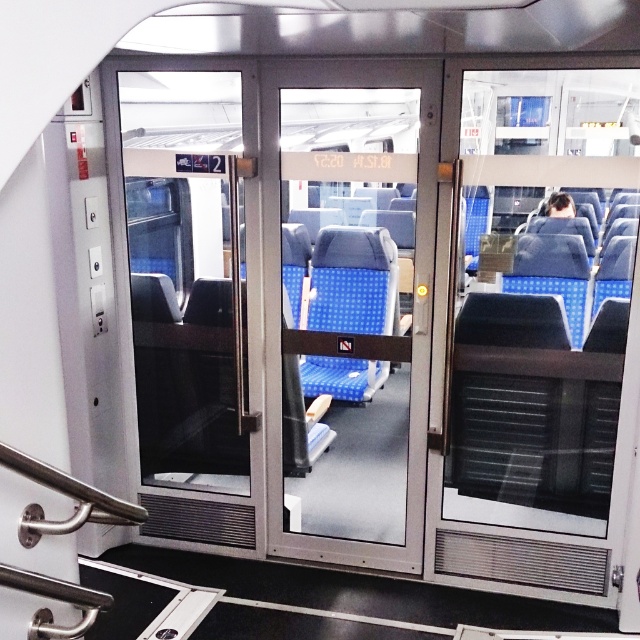
Question: Which point is farther to the camera?

Choices:
 (A) (282, 548)
 (B) (502, 316)

Answer: (A)

Question: Can you confirm if transparent glass door at right is smaller than transparent glass door at center?

Choices:
 (A) no
 (B) yes

Answer: (B)

Question: Which of the following is the farthest from the observer?

Choices:
 (A) (397, 246)
 (B) (616, 296)

Answer: (A)

Question: Does transparent glass door at right have a greater width compared to transparent glass door at center?

Choices:
 (A) no
 (B) yes

Answer: (B)

Question: Does transparent glass door at right lie in front of transparent glass door at center?

Choices:
 (A) yes
 (B) no

Answer: (A)